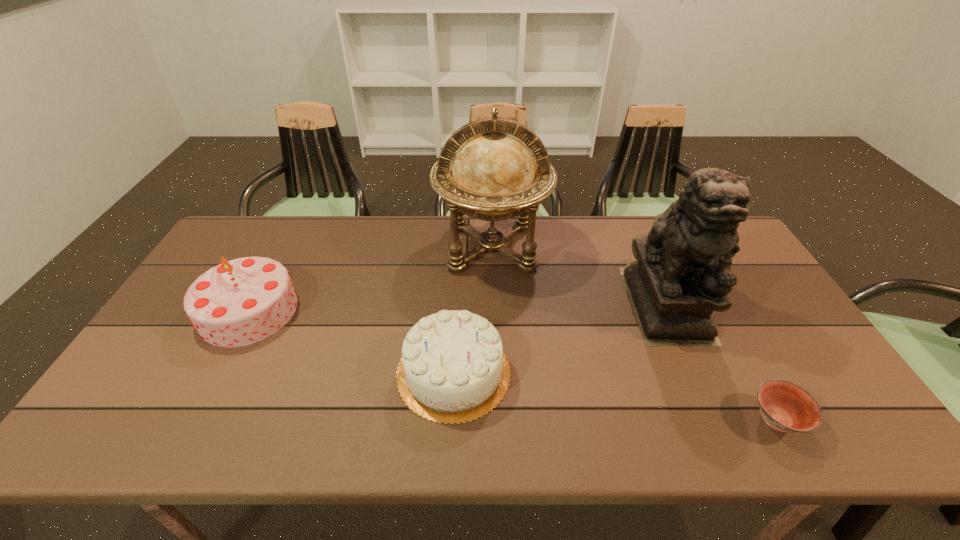
The width and height of the screenshot is (960, 540). In order to click on vacant area located 0.250m on the left of the second shortest object in this screenshot , I will do `click(297, 372)`.

Where is `blank space located on the back of the bowl`? This screenshot has height=540, width=960. blank space located on the back of the bowl is located at coordinates (729, 332).

I want to click on object located in the far edge section of the desktop, so click(493, 176).

At what (x,y) coordinates should I click in order to perform the action: click on birthday cake at the near edge. Please return your answer as a coordinate pair (x, y). This screenshot has height=540, width=960. Looking at the image, I should click on (453, 369).

Where is `bowl located in the near edge section of the desktop`? The image size is (960, 540). bowl located in the near edge section of the desktop is located at coordinates (784, 406).

You are a GUI agent. You are given a task and a screenshot of the screen. Output one action in this format:
    pyautogui.click(x=<x>, y=<y>)
    Task: Click on the object that is positioned at the left edge
    This screenshot has width=960, height=540.
    Given the screenshot: What is the action you would take?
    pyautogui.click(x=242, y=301)

The height and width of the screenshot is (540, 960). Identify the location of object at the right edge. (784, 406).

This screenshot has width=960, height=540. In order to click on object present at the near right corner in this screenshot , I will do `click(784, 406)`.

Find the location of `vacant space at the far edge`. vacant space at the far edge is located at coordinates (399, 243).

I want to click on vacant area at the near edge of the desktop, so click(605, 436).